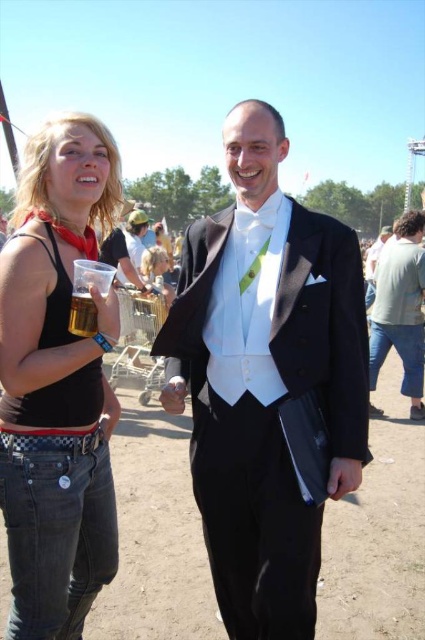
Question: Is matte black tank top at left wider than translucent plastic cup at lower left?

Choices:
 (A) no
 (B) yes

Answer: (B)

Question: Can you confirm if black satin tuxedo at center is positioned to the left of matte black tank top at left?

Choices:
 (A) yes
 (B) no

Answer: (B)

Question: Estimate the real-world distances between objects in this image. Which object is closer to the matte black tank top at left?

Choices:
 (A) translucent plastic cup at lower left
 (B) black satin tuxedo at center

Answer: (A)

Question: Among these objects, which one is farthest from the camera?

Choices:
 (A) matte black tank top at left
 (B) black satin tuxedo at center
 (C) translucent plastic cup at lower left

Answer: (B)

Question: Is matte black tank top at left bigger than translucent plastic cup at lower left?

Choices:
 (A) no
 (B) yes

Answer: (B)

Question: Considering the real-world distances, which object is closest to the matte black tank top at left?

Choices:
 (A) translucent plastic cup at lower left
 (B) black satin tuxedo at center

Answer: (A)